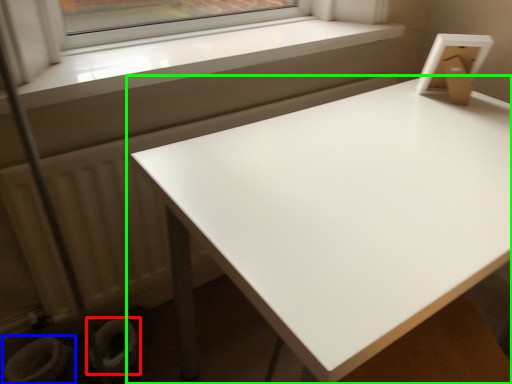
Question: Based on their relative distances, which object is nearer to toilet bowl (highlighted by a red box)? Choose from toilet bowl (highlighted by a blue box) and table (highlighted by a green box).

Choices:
 (A) toilet bowl
 (B) table

Answer: (A)